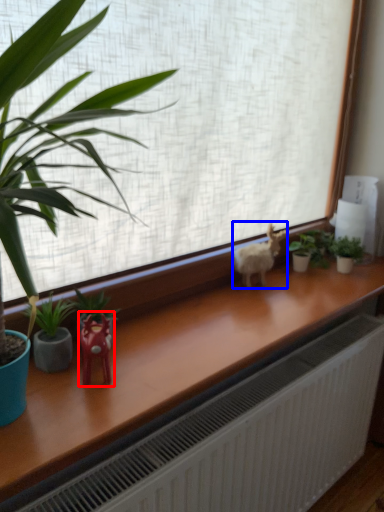
Question: Which point is closer to the camera, miniature (highlighted by a red box) or animal (highlighted by a blue box)?

Choices:
 (A) miniature
 (B) animal

Answer: (A)